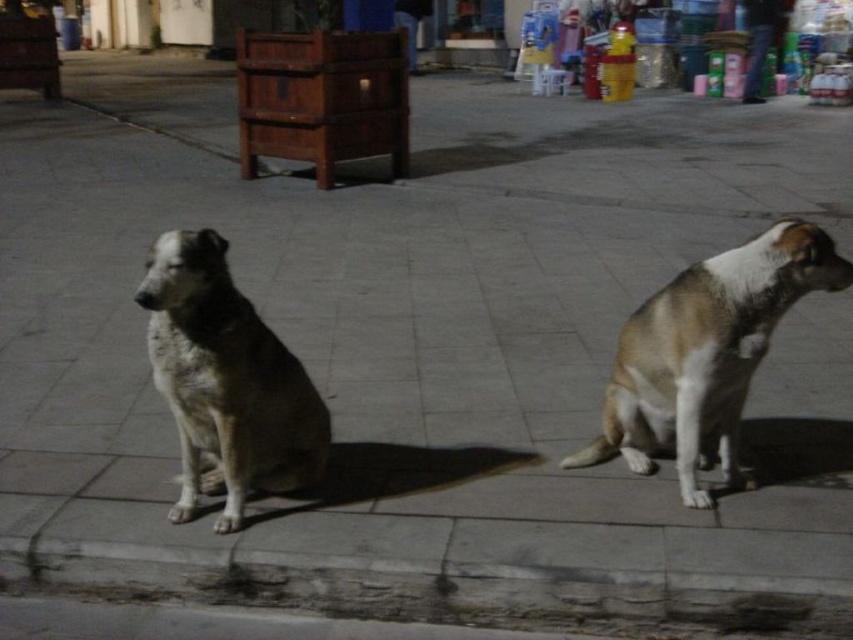
Find the location of `brown fur dog at right`. brown fur dog at right is located at coordinates point(705,353).

Who is lower down, concrete curb at lower center or fuzzy fur dog at left?

Positioned lower is concrete curb at lower center.

Is concrete curb at lower center thinner than fuzzy fur dog at left?

In fact, concrete curb at lower center might be wider than fuzzy fur dog at left.

Is point (753, 618) farther from viewer compared to point (202, 417)?

No, it is not.

Locate an element on the screen. This screenshot has height=640, width=853. concrete curb at lower center is located at coordinates pos(438,589).

Does concrete curb at lower center have a larger size compared to brown fur dog at right?

No, concrete curb at lower center is not bigger than brown fur dog at right.

Measure the distance from concrete curb at lower center to brown fur dog at right.

They are 35.38 inches apart.

Where is `concrete curb at lower center`? concrete curb at lower center is located at coordinates (438, 589).

I want to click on concrete curb at lower center, so click(438, 589).